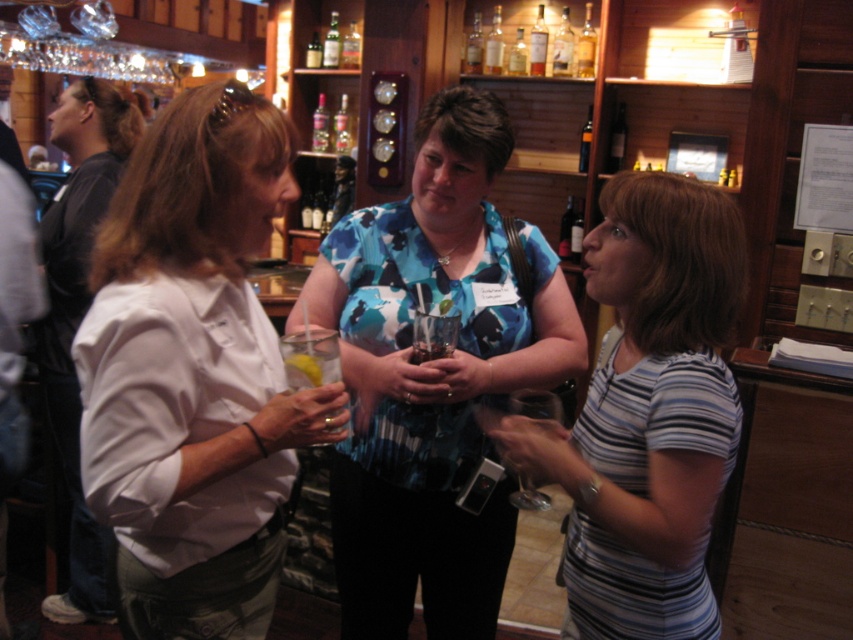
Does blue printed blouse at center appear over translucent glass bottle at center?

No, blue printed blouse at center is not above translucent glass bottle at center.

What do you see at coordinates (433, 376) in the screenshot?
I see `blue printed blouse at center` at bounding box center [433, 376].

Does point (320, 257) come farther from viewer compared to point (624, 125)?

No, (320, 257) is in front of (624, 125).

Where is `blue printed blouse at center`? This screenshot has width=853, height=640. blue printed blouse at center is located at coordinates (433, 376).

Who is positioned more to the right, transparent glass wine glass at center or translucent glass bottle at center?

Positioned to the right is translucent glass bottle at center.

Who is shorter, transparent glass wine glass at center or translucent glass bottle at center?

With less height is transparent glass wine glass at center.

Locate an element on the screen. The image size is (853, 640). transparent glass wine glass at center is located at coordinates (537, 404).

Is blue printed blouse at center above transparent glass wine glass at center?

Indeed, blue printed blouse at center is positioned over transparent glass wine glass at center.

Does blue printed blouse at center appear on the left side of transparent glass wine glass at center?

Correct, you'll find blue printed blouse at center to the left of transparent glass wine glass at center.

Locate an element on the screen. The image size is (853, 640). blue printed blouse at center is located at coordinates (433, 376).

The width and height of the screenshot is (853, 640). Find the location of `blue printed blouse at center`. blue printed blouse at center is located at coordinates (433, 376).